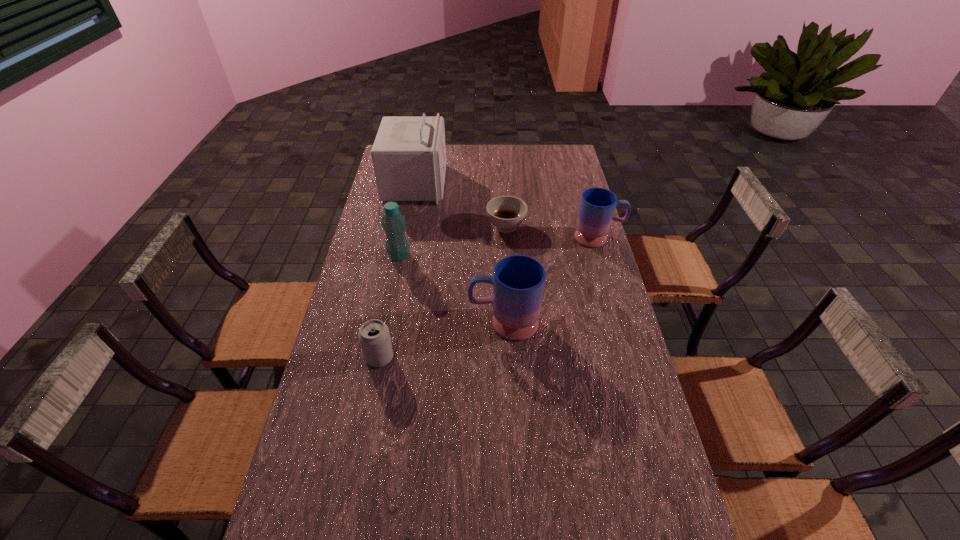
Identify the location of free region located on the side of the taller mug with the handle. (412, 322).

Identify the location of vacant space situated on the side of the taller mug with the handle. (453, 322).

At what (x,y) coordinates should I click in order to perform the action: click on vacant space located 0.090m on the side of the taller mug with the handle. Please return your answer as a coordinate pair (x, y). The height and width of the screenshot is (540, 960). Looking at the image, I should click on (441, 322).

This screenshot has width=960, height=540. What are the coordinates of `vacant region located 0.400m on the back of the shortest object` in the screenshot? It's located at (502, 163).

Image resolution: width=960 pixels, height=540 pixels. Identify the location of vacant area situated on the front-facing side of the first-aid kit. (477, 184).

Locate an element on the screen. free point located at the front cap of the water bottle is located at coordinates (446, 255).

At what (x,y) coordinates should I click in order to perform the action: click on free location located on the left of the can. Please return your answer as a coordinate pair (x, y). Image resolution: width=960 pixels, height=540 pixels. Looking at the image, I should click on (328, 357).

At what (x,y) coordinates should I click in order to perform the action: click on object located at the far edge. Please return your answer as a coordinate pair (x, y). This screenshot has width=960, height=540. Looking at the image, I should click on (409, 152).

This screenshot has width=960, height=540. In order to click on the first-aid kit at the left edge in this screenshot , I will do `click(409, 152)`.

Find the location of a particular element. The image size is (960, 540). water bottle present at the left edge is located at coordinates (394, 224).